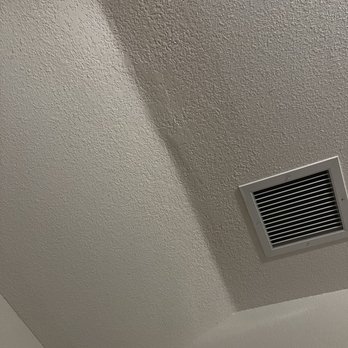
Where is `top vent border`? top vent border is located at coordinates (299, 172).